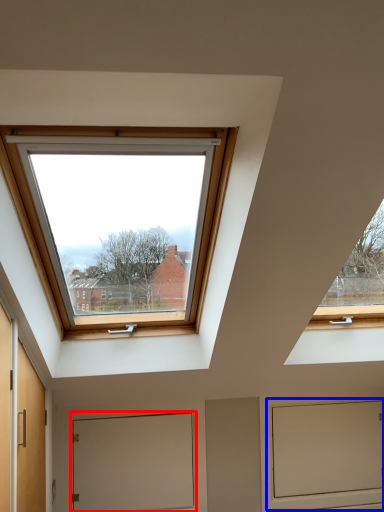
Question: Among these objects, which one is nearest to the camera, door (highlighted by a red box) or screen door (highlighted by a blue box)?

Choices:
 (A) door
 (B) screen door

Answer: (A)